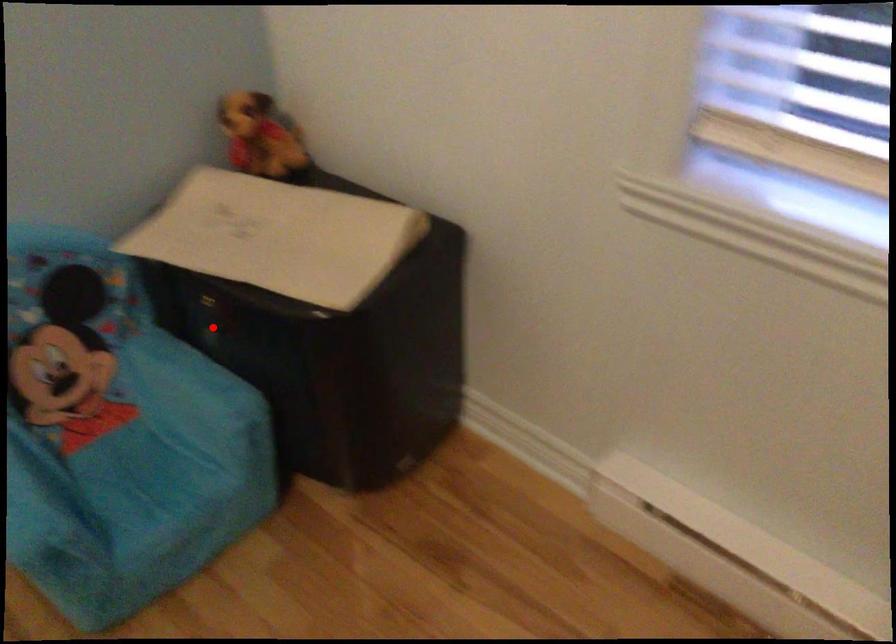
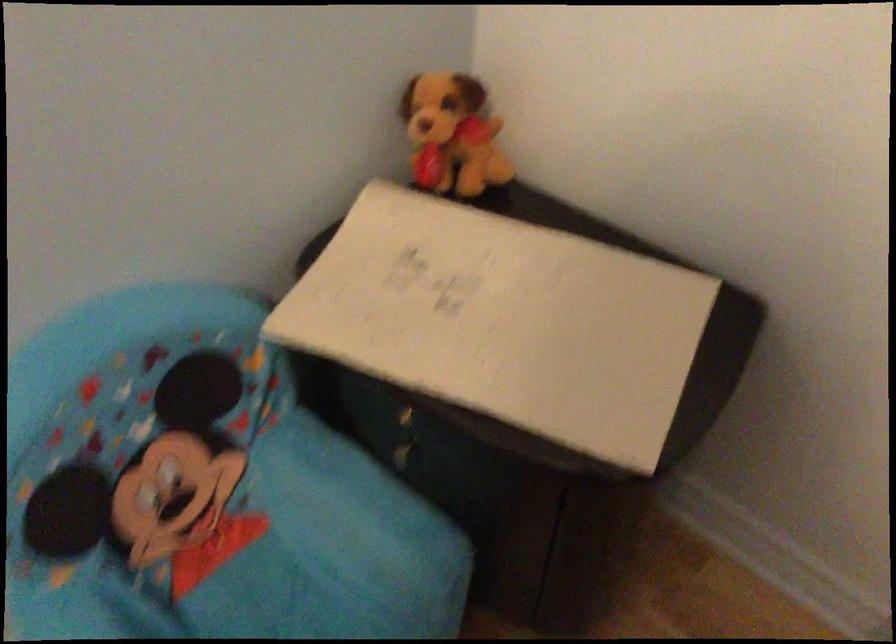
Question: I am providing you with two images of the same scene from different viewpoints. A red point is marked on the first image. Can you still see the location of the red point in image 2?

Choices:
 (A) Yes
 (B) No

Answer: (A)